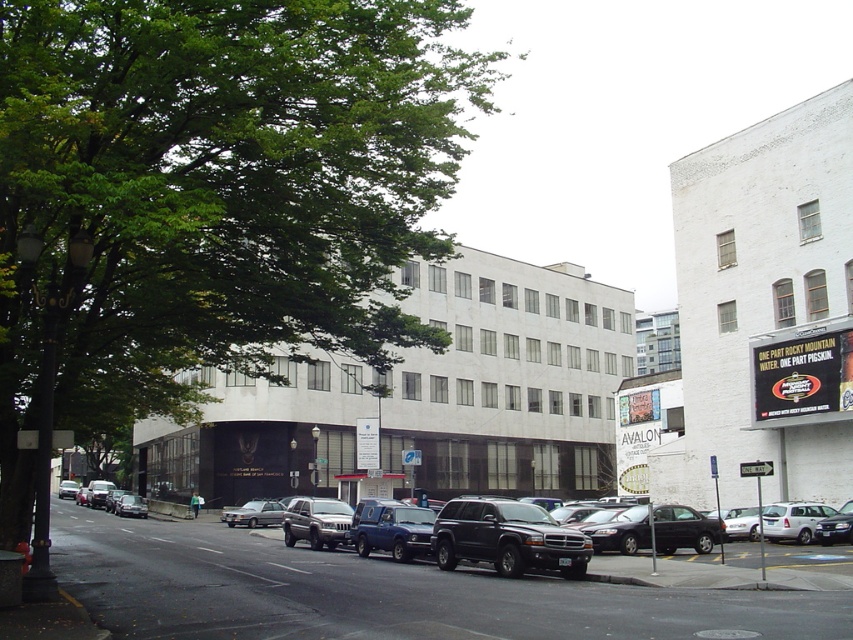
You are standing at the point marked by the coordinates in the image. Which object is located at the coordinates point (212,193)?

The point (212,193) marks the location of the green leafy tree at upper left.

You are a delivery person trying to park your 1.8 meters tall delivery box next to the silver metallic sedan at center. Considering the green leafy tree at upper left, will there be enough vertical space for your delivery box between the tree and the sedan?

The green leafy tree at upper left has a greater height compared to the silver metallic sedan at center. Since the delivery box is 1.8 meters tall, and the sedan is shorter than the tree, there should be sufficient vertical clearance between them for the delivery box.

You are standing at the lamppost on the left side of the street and want to walk to the point marked as point (345, 506). However, there is an obstacle at point (96, 154). Will you encounter this obstacle before reaching your destination?

Yes, you will encounter the obstacle at point (96, 154) before reaching point (345, 506) because point (96, 154) is in front of point (345, 506) from your starting position at the lamppost.